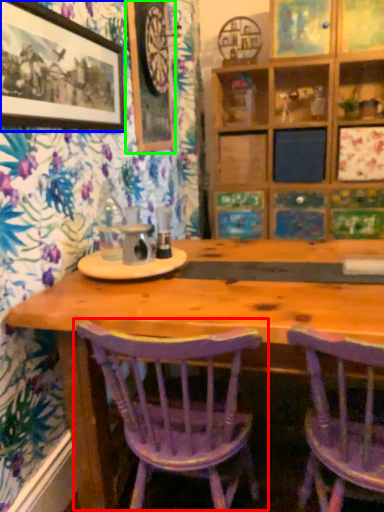
Question: Which object is the farthest from chair (highlighted by a red box)? Choose among these: picture frame (highlighted by a blue box) or picture frame (highlighted by a green box).

Choices:
 (A) picture frame
 (B) picture frame

Answer: (B)